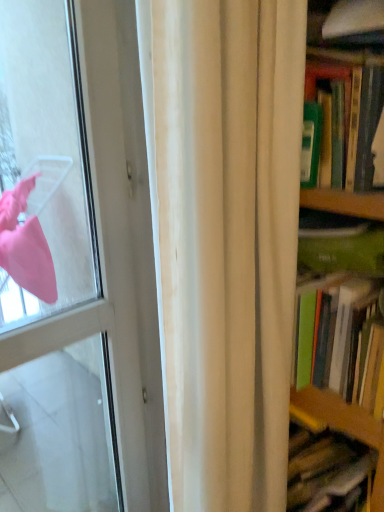
Question: Can you confirm if green matte book at right is shorter than white glossy door at left?

Choices:
 (A) yes
 (B) no

Answer: (A)

Question: Can you confirm if green matte book at right is taller than white glossy door at left?

Choices:
 (A) no
 (B) yes

Answer: (A)

Question: Is white glossy door at left surrounded by green matte book at right?

Choices:
 (A) no
 (B) yes

Answer: (A)

Question: Is green matte book at right not inside white glossy door at left?

Choices:
 (A) no
 (B) yes

Answer: (B)

Question: Is green matte book at right positioned before white glossy door at left?

Choices:
 (A) no
 (B) yes

Answer: (A)

Question: Considering their positions, is white fabric curtain at center located in front of or behind white glossy door at left?

Choices:
 (A) behind
 (B) front

Answer: (B)

Question: From a real-world perspective, is white fabric curtain at center physically located above or below white glossy door at left?

Choices:
 (A) below
 (B) above

Answer: (B)

Question: Considering the positions of white fabric curtain at center and white glossy door at left in the image, is white fabric curtain at center taller or shorter than white glossy door at left?

Choices:
 (A) short
 (B) tall

Answer: (A)

Question: In terms of size, does white fabric curtain at center appear bigger or smaller than white glossy door at left?

Choices:
 (A) big
 (B) small

Answer: (A)

Question: In the image, is white glossy door at left positioned in front of or behind green matte book at right?

Choices:
 (A) front
 (B) behind

Answer: (A)

Question: From the image's perspective, relative to green matte book at right, is white glossy door at left above or below?

Choices:
 (A) above
 (B) below

Answer: (B)

Question: Considering the positions of point (66, 439) and point (349, 129), is point (66, 439) closer or farther from the camera than point (349, 129)?

Choices:
 (A) closer
 (B) farther

Answer: (B)

Question: Do you think white glossy door at left is within green matte book at right, or outside of it?

Choices:
 (A) outside
 (B) inside

Answer: (A)

Question: From the image's perspective, is white glossy door at left above or below white fabric curtain at center?

Choices:
 (A) below
 (B) above

Answer: (B)

Question: In terms of height, does white glossy door at left look taller or shorter compared to white fabric curtain at center?

Choices:
 (A) short
 (B) tall

Answer: (B)